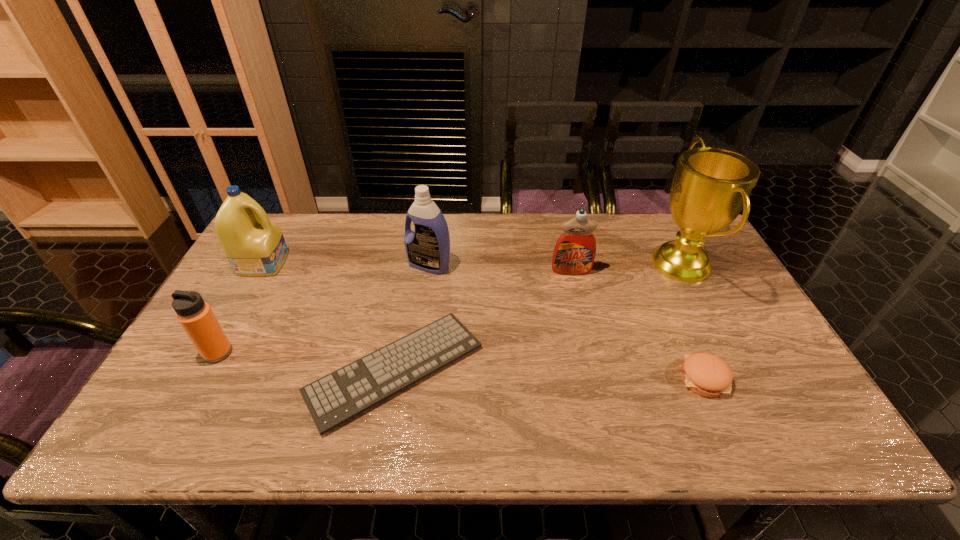
Find the location of a particular element. The height and width of the screenshot is (540, 960). detergent object that ranks as the closest to the leftmost detergent is located at coordinates (427, 248).

Identify which detergent is located as the third nearest to the computer keyboard. Please provide its 2D coordinates. Your answer should be formatted as a tuple, i.e. [(x, y)], where the tuple contains the x and y coordinates of a point satisfying the conditions above.

[(574, 253)]

This screenshot has height=540, width=960. I want to click on vacant space that satisfies the following two spatial constraints: 1. on the shiny surface of the tallest object; 2. on the front side of the second detergent from left to right, so click(682, 265).

The width and height of the screenshot is (960, 540). I want to click on vacant space that satisfies the following two spatial constraints: 1. on the front side of the second shortest object; 2. on the right side of the second detergent from right to left, so click(x=414, y=378).

The height and width of the screenshot is (540, 960). Find the location of `free space that satisfies the following two spatial constraints: 1. on the label of the leftmost detergent; 2. on the left side of the computer keyboard`. free space that satisfies the following two spatial constraints: 1. on the label of the leftmost detergent; 2. on the left side of the computer keyboard is located at coordinates (204, 369).

In order to click on vacant space that satisfies the following two spatial constraints: 1. on the label of the thermos bottle; 2. on the right side of the leftmost detergent in this screenshot , I will do `click(213, 353)`.

At what (x,y) coordinates should I click in order to perform the action: click on free space that satisfies the following two spatial constraints: 1. on the label of the thermos bottle; 2. on the left side of the leftmost detergent. Please return your answer as a coordinate pair (x, y). This screenshot has height=540, width=960. Looking at the image, I should click on 213,353.

Where is `vacant space that satisfies the following two spatial constraints: 1. on the shiny surface of the award; 2. on the front surface of the rightmost detergent`? The image size is (960, 540). vacant space that satisfies the following two spatial constraints: 1. on the shiny surface of the award; 2. on the front surface of the rightmost detergent is located at coordinates (684, 271).